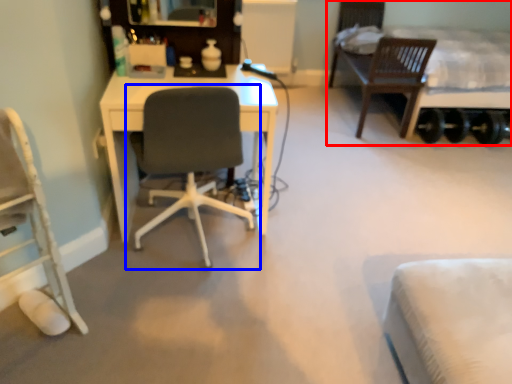
Question: Which object appears farthest to the camera in this image, bed (highlighted by a red box) or chair (highlighted by a blue box)?

Choices:
 (A) bed
 (B) chair

Answer: (A)